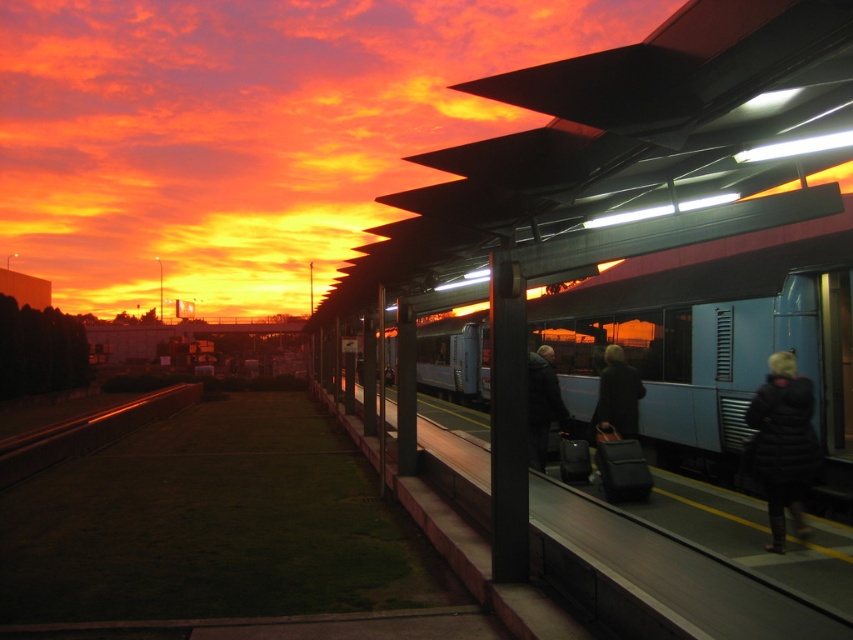
You are a photographer trying to capture the sunset at the train station. You notice the black metal train track at lower left and the dark gray jacket at center. Which object would appear wider in your photo?

The black metal train track at lower left appears wider than the dark gray jacket at center because its width is larger.

You are standing on the platform at the train station and see both the black puffy coat at lower right and the dark gray coat at center. Which person is closer to the edge of the platform?

The black puffy coat at lower right is to the right of the dark gray coat at center, so the person wearing the black puffy coat at lower right is closer to the edge of the platform.

You are standing at the center of the train station platform and want to find the black puffy coat at lower right. According to the coordinates provided, in which direction should you move to locate it?

The black puffy coat at lower right is located at coordinates point (782, 444). Since you are at the center, you should move towards the lower right direction to find it.